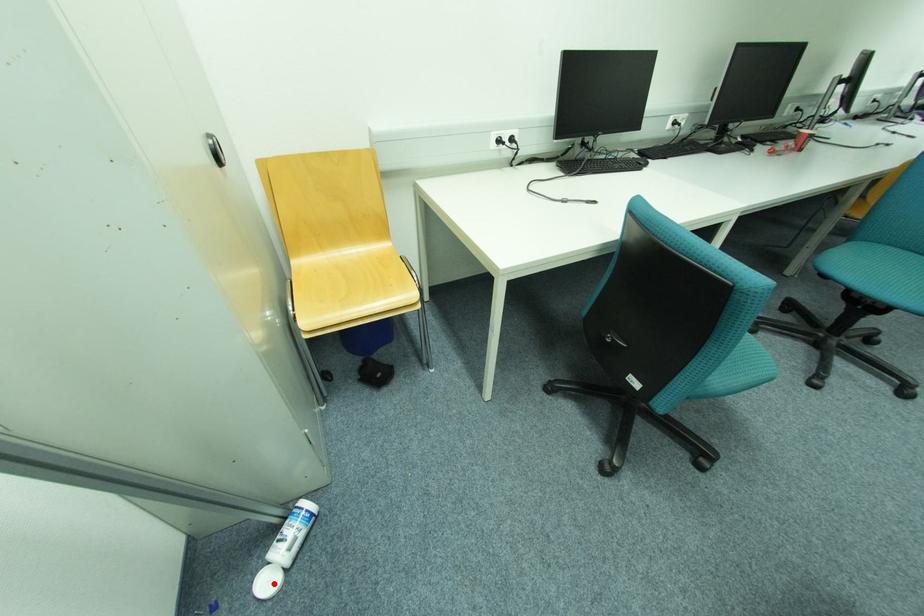
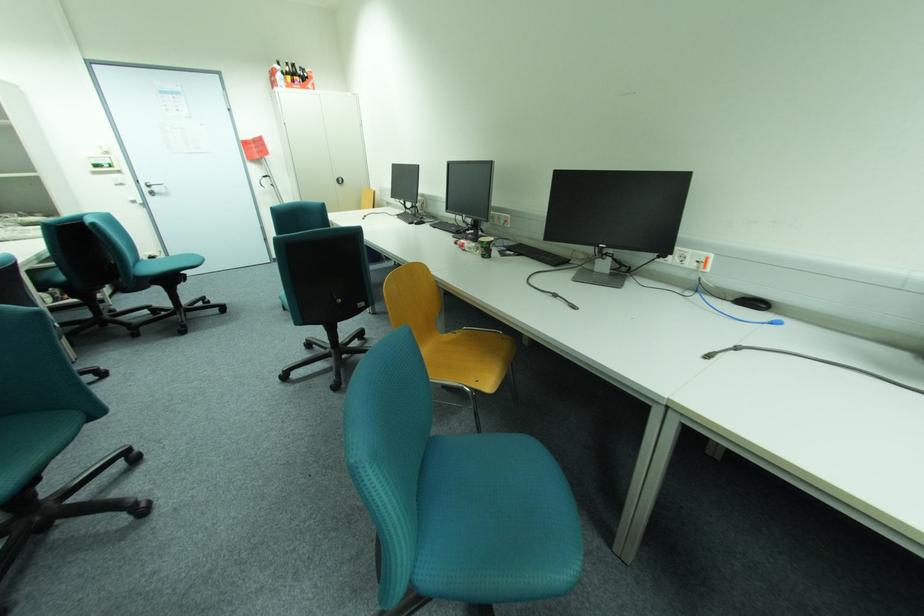
Question: I am providing you with two images of the same scene from different viewpoints. A red point is marked on the first image. Can you still see the location of the red point in image 2?

Choices:
 (A) Yes
 (B) No

Answer: (B)